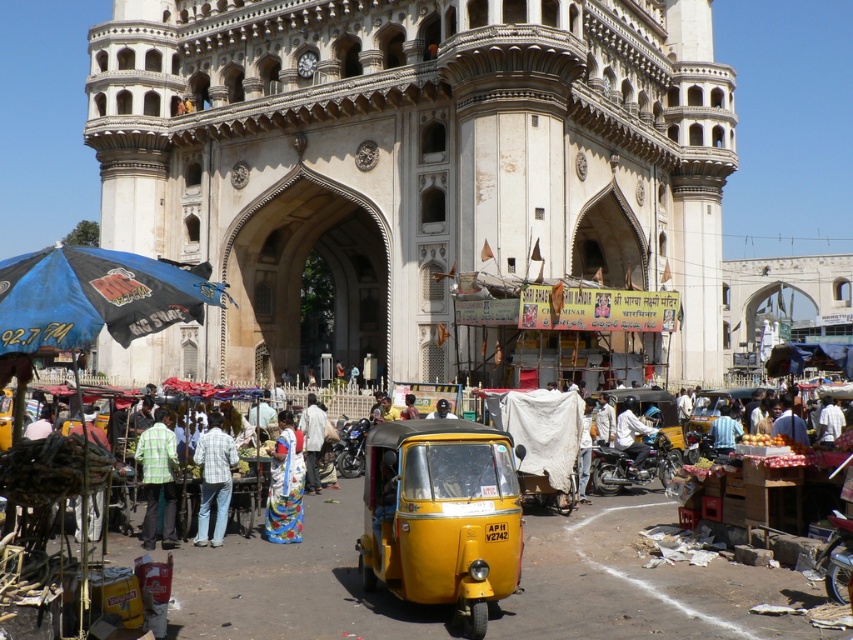
Question: Can you confirm if yellow matte auto-rickshaw at center is wider than blue shirt at center?

Choices:
 (A) no
 (B) yes

Answer: (B)

Question: Among these objects, which one is farthest from the camera?

Choices:
 (A) white matte shirt at center
 (B) blue fabric umbrella at left
 (C) blue shirt at center

Answer: (C)

Question: Which object is farther from the camera taking this photo?

Choices:
 (A) blue shirt at center
 (B) plaid shirt at center

Answer: (A)

Question: Is white printed sari at center to the left of light brown fabric at center from the viewer's perspective?

Choices:
 (A) no
 (B) yes

Answer: (B)

Question: Which is nearer to the blue shirt at center?

Choices:
 (A) white matte shirt at center
 (B) white stone building at center
 (C) light brown fabric at center

Answer: (A)

Question: Is the position of yellow matte auto-rickshaw at center less distant than that of dark blue fabric at center?

Choices:
 (A) no
 (B) yes

Answer: (B)